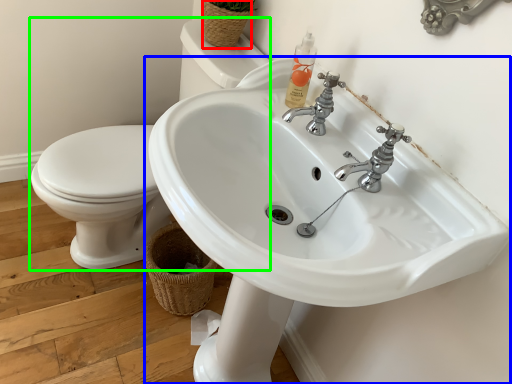
Question: Considering the real-world distances, which object is closest to basket (highlighted by a red box)? sink (highlighted by a blue box) or sink (highlighted by a green box).

Choices:
 (A) sink
 (B) sink

Answer: (B)